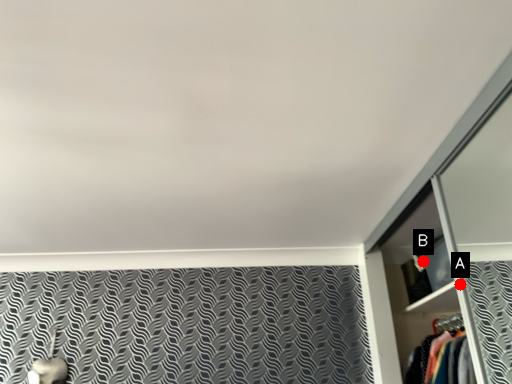
Question: Two points are circled on the image, labeled by A and B beside each circle. Which point is closer to the camera taking this photo?

Choices:
 (A) A is closer
 (B) B is closer

Answer: (A)